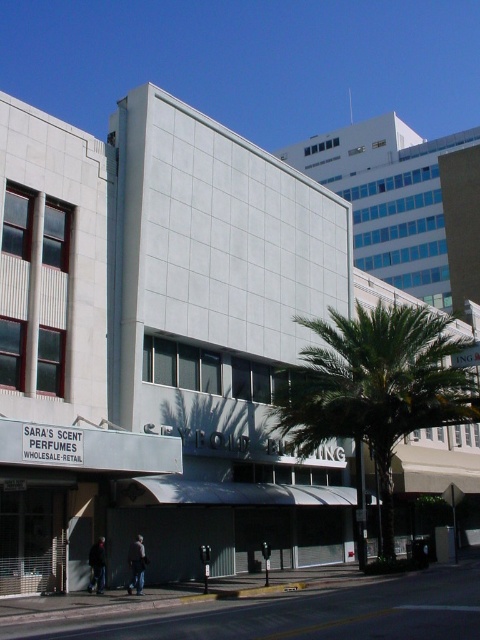
Question: Considering the real-world distances, which object is closest to the green leafy palm tree at center?

Choices:
 (A) dark gray jacket at lower center
 (B) dark gray jacket at lower left

Answer: (A)

Question: Does green leafy palm tree at center have a larger size compared to dark gray jacket at lower center?

Choices:
 (A) yes
 (B) no

Answer: (A)

Question: Is green leafy palm tree at center wider than dark gray jacket at lower center?

Choices:
 (A) yes
 (B) no

Answer: (A)

Question: Which object is farther from the camera taking this photo?

Choices:
 (A) dark gray jacket at lower left
 (B) dark gray jacket at lower center

Answer: (A)

Question: Can you confirm if green leafy palm tree at center is thinner than dark gray jacket at lower left?

Choices:
 (A) yes
 (B) no

Answer: (B)

Question: Estimate the real-world distances between objects in this image. Which object is closer to the dark gray jacket at lower left?

Choices:
 (A) dark gray jacket at lower center
 (B) green leafy palm tree at center

Answer: (A)